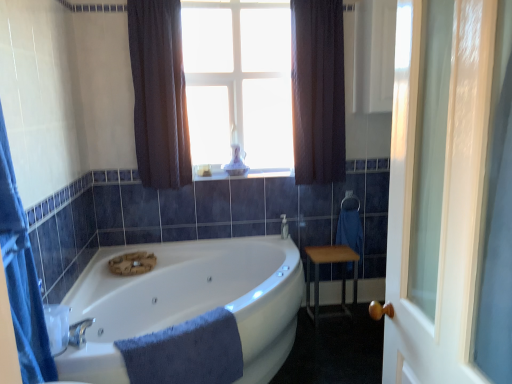
Question: Considering the positions of dark fabric curtain at upper center, which is the second curtain in right-to-left order, and transparent glass candle at upper center in the image, is dark fabric curtain at upper center, which is the second curtain in right-to-left order, bigger or smaller than transparent glass candle at upper center?

Choices:
 (A) small
 (B) big

Answer: (B)

Question: From a real-world perspective, is dark fabric curtain at upper center, which is the second curtain in right-to-left order, above or below transparent glass candle at upper center?

Choices:
 (A) below
 (B) above

Answer: (A)

Question: Which is nearer to the white glossy window sill at center?

Choices:
 (A) silver metallic towel bar at right
 (B) clear glass door at right
 (C) blue soft towel at lower center
 (D) dark fabric curtain at upper center, which is the second curtain in right-to-left order
 (E) dark textured curtain at upper center, the 1th curtain positioned from the right

Answer: (E)

Question: Estimate the real-world distances between objects in this image. Which object is closer to the blue soft towel at lower center?

Choices:
 (A) white glossy bathtub at center
 (B) silver metallic towel bar at right
 (C) transparent glass candle at upper center
 (D) dark textured curtain at upper center, the 1th curtain positioned from the right
 (E) dark fabric curtain at upper center, which is the second curtain in right-to-left order

Answer: (A)